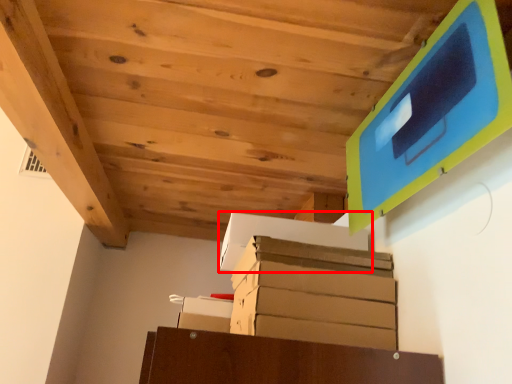
Question: From the image's perspective, what is the correct spatial positioning of cardboard box (annotated by the red box) in reference to cardboard box?

Choices:
 (A) below
 (B) above

Answer: (B)